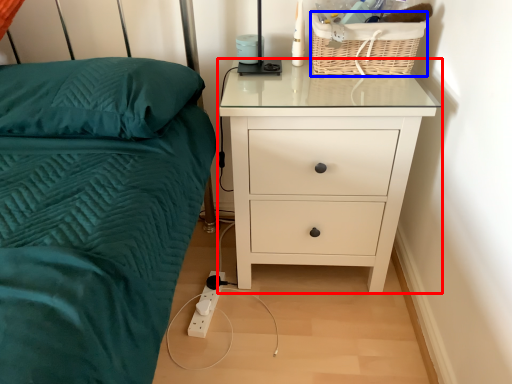
Question: Which object appears closest to the camera in this image, chest of drawers (highlighted by a red box) or basket (highlighted by a blue box)?

Choices:
 (A) chest of drawers
 (B) basket

Answer: (A)